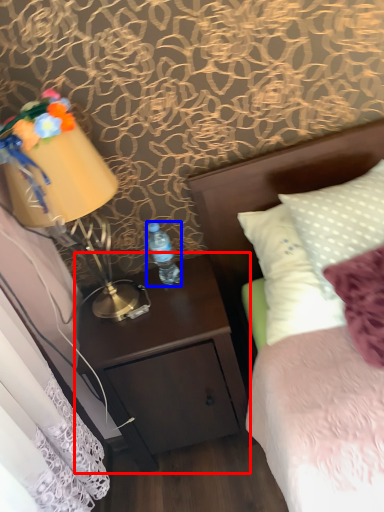
Question: Which object appears farthest to the camera in this image, nightstand (highlighted by a red box) or bottle (highlighted by a blue box)?

Choices:
 (A) nightstand
 (B) bottle

Answer: (B)